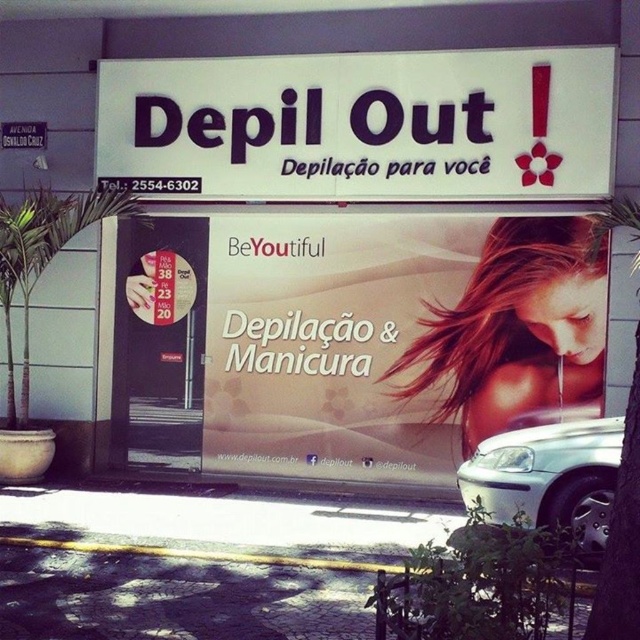
Between point (404, 220) and point (456, 125), which one is positioned in front?

Point (456, 125) is in front.

Based on the photo, does matte white banner at center appear over white plastic sign at upper center?

Actually, matte white banner at center is below white plastic sign at upper center.

Describe the element at coordinates (349, 339) in the screenshot. I see `matte white banner at center` at that location.

The height and width of the screenshot is (640, 640). Identify the location of matte white banner at center. coord(349,339).

Is white plastic sign at upper center below silver metallic car at lower right?

No, white plastic sign at upper center is not below silver metallic car at lower right.

Does white plastic sign at upper center have a larger size compared to silver metallic car at lower right?

Indeed, white plastic sign at upper center has a larger size compared to silver metallic car at lower right.

Who is more forward, (230, 163) or (588, 481)?

Positioned in front is point (588, 481).

This screenshot has width=640, height=640. Find the location of `white plastic sign at upper center`. white plastic sign at upper center is located at coordinates pyautogui.click(x=362, y=125).

Between matte white banner at center and silver metallic car at lower right, which one is positioned higher?

Positioned higher is matte white banner at center.

Is matte white banner at center to the left of silver metallic car at lower right from the viewer's perspective?

In fact, matte white banner at center is to the right of silver metallic car at lower right.

Which is in front, point (358, 324) or point (579, 548)?

Positioned in front is point (579, 548).

Find the location of `matte white banner at center`. matte white banner at center is located at coordinates (349, 339).